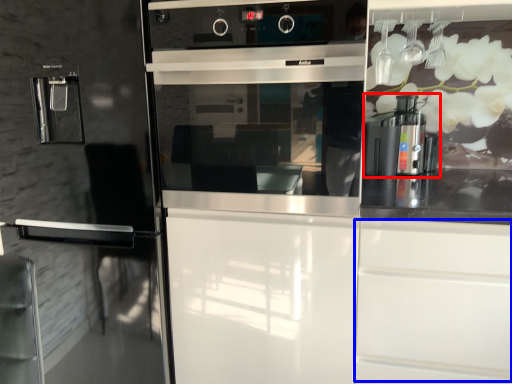
Question: Which object is further to the camera taking this photo, coffee machine (highlighted by a red box) or drawer (highlighted by a blue box)?

Choices:
 (A) coffee machine
 (B) drawer

Answer: (A)